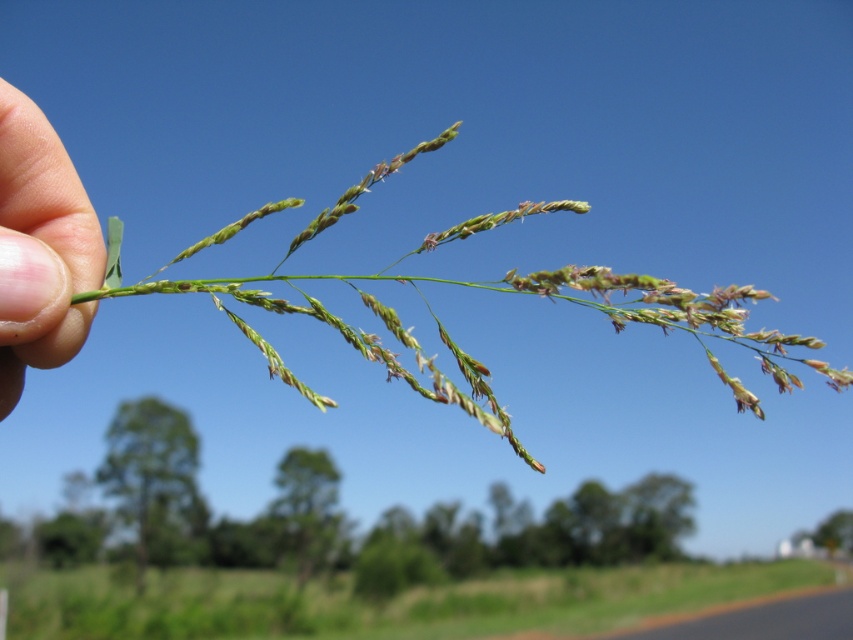
Question: Does green leafy grass at lower center have a lesser width compared to green matte grass at upper left?

Choices:
 (A) no
 (B) yes

Answer: (A)

Question: Does green leafy grass at lower center have a greater width compared to green matte grass at upper left?

Choices:
 (A) no
 (B) yes

Answer: (B)

Question: Does green leafy grass at lower center appear on the right side of flesh-toned skin at left?

Choices:
 (A) no
 (B) yes

Answer: (A)

Question: Which point is farther to the camera?

Choices:
 (A) flesh-toned skin at left
 (B) green matte grass at upper left
 (C) green leafy grass at lower center

Answer: (C)

Question: Which of the following is the farthest from the observer?

Choices:
 (A) (633, 317)
 (B) (74, 308)

Answer: (B)

Question: Which object appears farthest from the camera in this image?

Choices:
 (A) green matte grass at upper left
 (B) green leafy grass at lower center

Answer: (B)